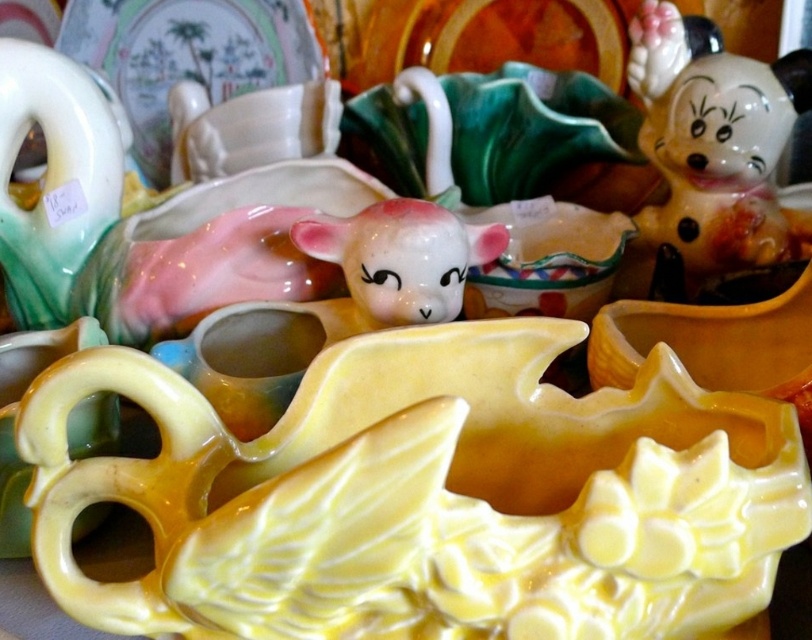
Question: Can you confirm if white glossy minnie mouse figurine at upper right is wider than matte porcelain lamb at center?

Choices:
 (A) yes
 (B) no

Answer: (A)

Question: Which of the following is the farthest from the observer?

Choices:
 (A) (663, 74)
 (B) (378, 209)

Answer: (A)

Question: In this image, where is white glossy minnie mouse figurine at upper right located relative to matte porcelain lamb at center?

Choices:
 (A) above
 (B) below

Answer: (A)

Question: Which of the following is the farthest from the observer?

Choices:
 (A) (385, 234)
 (B) (625, 289)

Answer: (B)

Question: Does white glossy minnie mouse figurine at upper right have a larger size compared to matte porcelain lamb at center?

Choices:
 (A) yes
 (B) no

Answer: (A)

Question: Among these points, which one is nearest to the camera?

Choices:
 (A) (758, 243)
 (B) (348, 236)

Answer: (B)